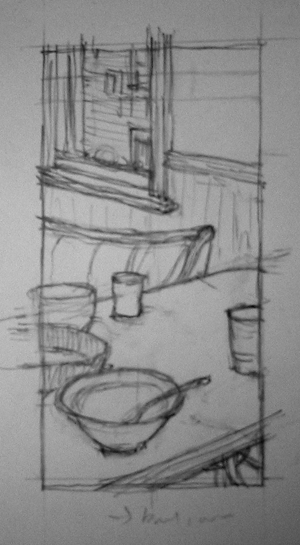
Find the location of a particular element. window sill is located at coordinates (98, 181).